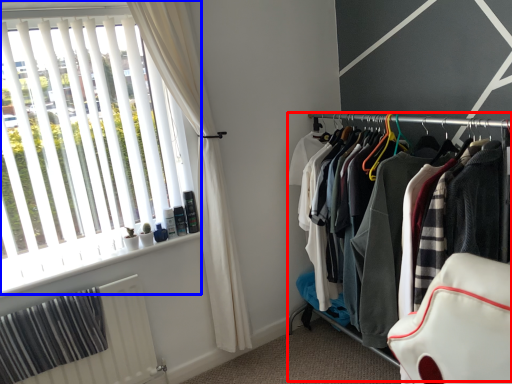
Question: Which object is further to the camera taking this photo, closet (highlighted by a red box) or window (highlighted by a blue box)?

Choices:
 (A) closet
 (B) window

Answer: (B)